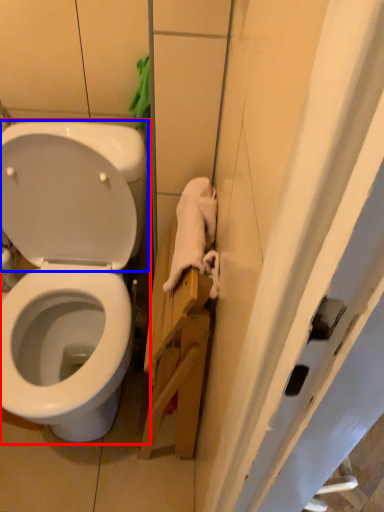
Question: Among these objects, which one is nearest to the camera, toilet (highlighted by a red box) or back (highlighted by a blue box)?

Choices:
 (A) toilet
 (B) back

Answer: (A)